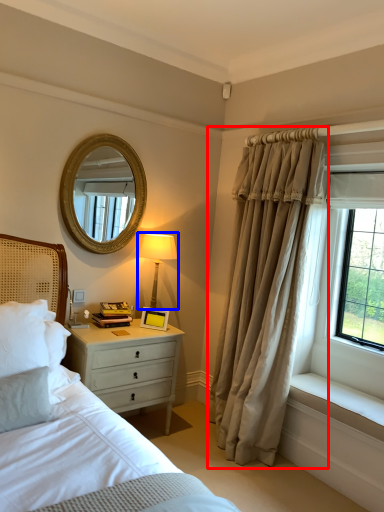
Question: Which object is closer to the camera taking this photo, curtain (highlighted by a red box) or bedside lamp (highlighted by a blue box)?

Choices:
 (A) curtain
 (B) bedside lamp

Answer: (A)